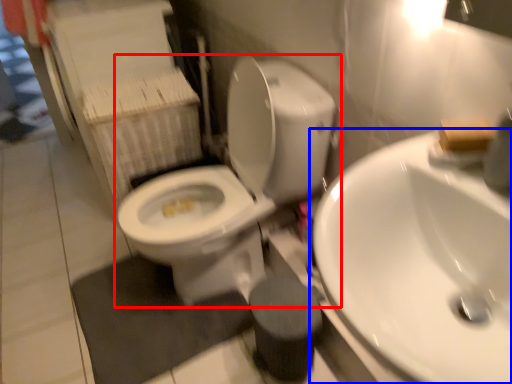
Question: Which object is closer to the camera taking this photo, toilet (highlighted by a red box) or sink (highlighted by a blue box)?

Choices:
 (A) toilet
 (B) sink

Answer: (B)